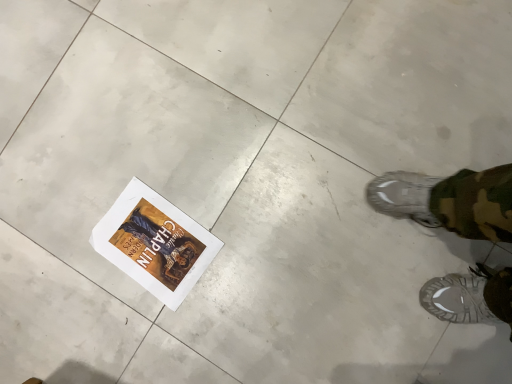
In order to click on vacant space to the left of white paper postcard at lower left in this screenshot , I will do `click(77, 296)`.